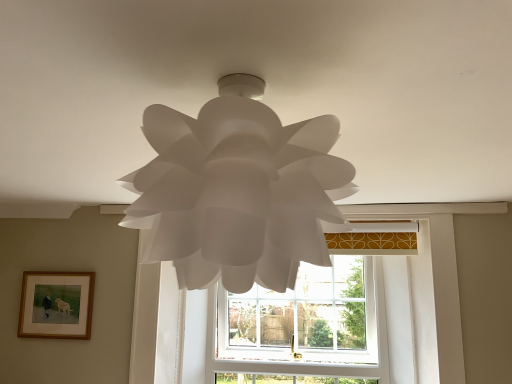
Question: Can we say wooden framed picture at lower left lies outside white plastic window at center?

Choices:
 (A) yes
 (B) no

Answer: (A)

Question: Does wooden framed picture at lower left have a larger size compared to white plastic window at center?

Choices:
 (A) yes
 (B) no

Answer: (B)

Question: Is wooden framed picture at lower left thinner than white plastic window at center?

Choices:
 (A) yes
 (B) no

Answer: (A)

Question: From a real-world perspective, is wooden framed picture at lower left located higher than white plastic window at center?

Choices:
 (A) yes
 (B) no

Answer: (A)

Question: Considering the relative sizes of wooden framed picture at lower left and white plastic window at center in the image provided, is wooden framed picture at lower left smaller than white plastic window at center?

Choices:
 (A) no
 (B) yes

Answer: (B)

Question: Looking at the image, does white paper lamp at center seem bigger or smaller compared to wooden framed picture at lower left?

Choices:
 (A) big
 (B) small

Answer: (A)

Question: Considering the positions of point (211, 225) and point (46, 336), is point (211, 225) closer or farther from the camera than point (46, 336)?

Choices:
 (A) closer
 (B) farther

Answer: (A)

Question: Choose the correct answer: Is white paper lamp at center inside wooden framed picture at lower left or outside it?

Choices:
 (A) outside
 (B) inside

Answer: (A)

Question: Is white paper lamp at center taller or shorter than wooden framed picture at lower left?

Choices:
 (A) tall
 (B) short

Answer: (A)

Question: Would you say white plastic window at center is to the left or to the right of wooden framed picture at lower left in the picture?

Choices:
 (A) left
 (B) right

Answer: (B)

Question: Looking at the image, does white plastic window at center seem bigger or smaller compared to wooden framed picture at lower left?

Choices:
 (A) big
 (B) small

Answer: (A)

Question: Is white plastic window at center wider or thinner than wooden framed picture at lower left?

Choices:
 (A) wide
 (B) thin

Answer: (A)

Question: From the image's perspective, is white plastic window at center positioned above or below wooden framed picture at lower left?

Choices:
 (A) below
 (B) above

Answer: (A)

Question: In the image, is wooden framed picture at lower left on the left side or the right side of white plastic window at center?

Choices:
 (A) right
 (B) left

Answer: (B)

Question: Considering the positions of wooden framed picture at lower left and white plastic window at center in the image, is wooden framed picture at lower left taller or shorter than white plastic window at center?

Choices:
 (A) tall
 (B) short

Answer: (B)